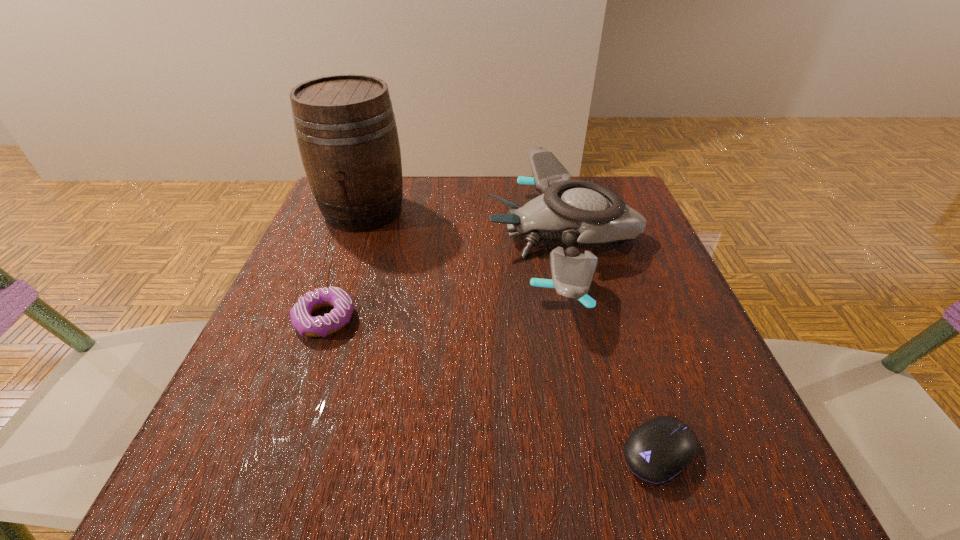
Where is `the tallest object`? the tallest object is located at coordinates (346, 130).

You are a GUI agent. You are given a task and a screenshot of the screen. Output one action in this format:
    pyautogui.click(x=<x>, y=<y>)
    Task: Click on the drone
    
    Given the screenshot: What is the action you would take?
    pyautogui.click(x=574, y=211)

Locate an element on the screen. This screenshot has height=540, width=960. doughnut is located at coordinates (300, 314).

I want to click on the nearest object, so click(657, 451).

The height and width of the screenshot is (540, 960). Find the location of `vacant space located on the side of the cider near the bung hole`. vacant space located on the side of the cider near the bung hole is located at coordinates (342, 270).

What are the coordinates of `free space located on the front-facing side of the drone` in the screenshot? It's located at (370, 238).

Locate an element on the screen. This screenshot has height=540, width=960. vacant space situated 0.200m on the front-facing side of the drone is located at coordinates (396, 238).

At what (x,y) coordinates should I click in order to perform the action: click on vacant space located on the front-facing side of the drone. Please return your answer as a coordinate pair (x, y). Image resolution: width=960 pixels, height=540 pixels. Looking at the image, I should click on (351, 238).

The image size is (960, 540). What are the coordinates of `free space located 0.170m on the back of the doughnut` in the screenshot? It's located at (352, 244).

The width and height of the screenshot is (960, 540). What are the coordinates of `free location located 0.220m on the left of the computer mouse` in the screenshot? It's located at (456, 453).